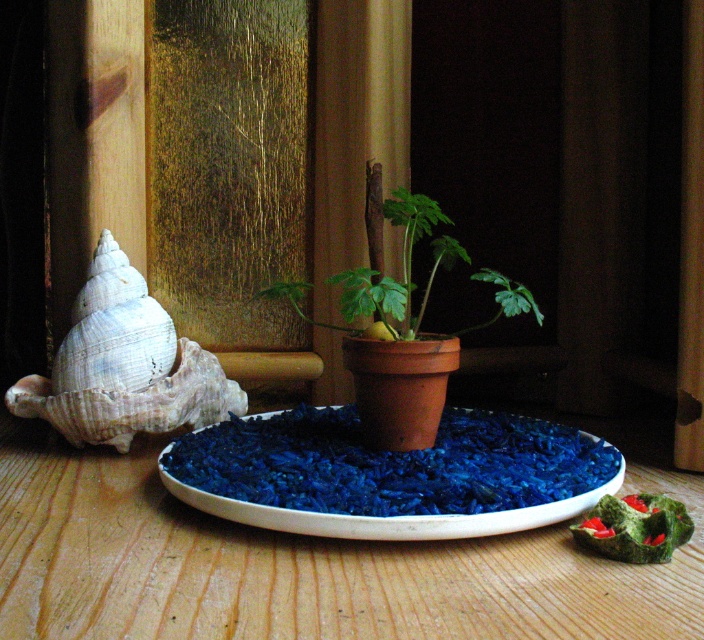
Between point (365, 310) and point (617, 529), which one is positioned in front?

Point (617, 529) is more forward.

Does point (372, 260) come in front of point (570, 525)?

No, it is behind (570, 525).

What are the coordinates of `green matte terracotta pot at center` in the screenshot? It's located at (402, 262).

The height and width of the screenshot is (640, 704). I want to click on white ceramic plate at center, so click(x=308, y=561).

Does point (612, 618) come behind point (367, 525)?

No, (612, 618) is closer to viewer.

The height and width of the screenshot is (640, 704). I want to click on white ceramic plate at center, so click(308, 561).

Who is taller, white ceramic plate at center or white shell at left?

white shell at left is taller.

Between white ceramic plate at center and white shell at left, which one is positioned higher?

white shell at left is higher up.

Locate an element on the screen. white ceramic plate at center is located at coordinates pyautogui.click(x=308, y=561).

I want to click on white ceramic plate at center, so 308,561.